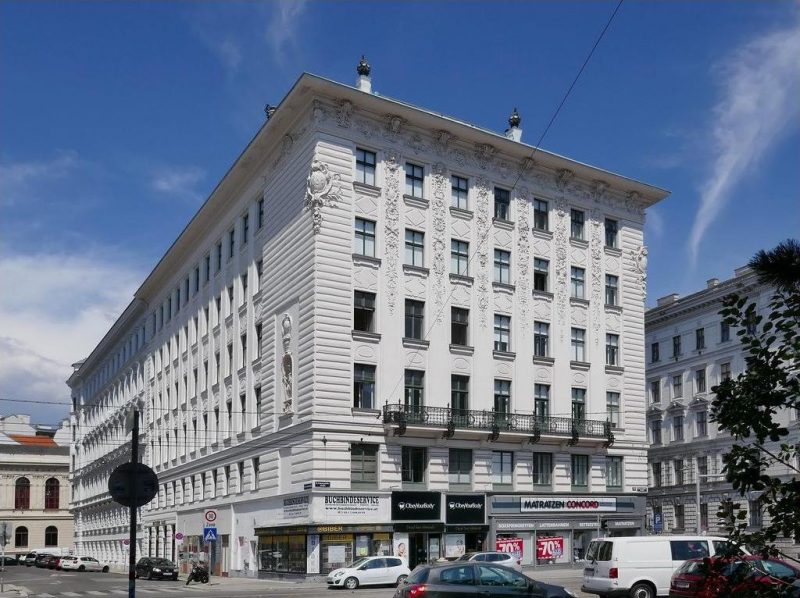
The height and width of the screenshot is (598, 800). I want to click on windows, so click(365, 317), click(357, 393), click(416, 384), click(462, 388), click(500, 395), click(542, 399), click(574, 402), click(612, 407).